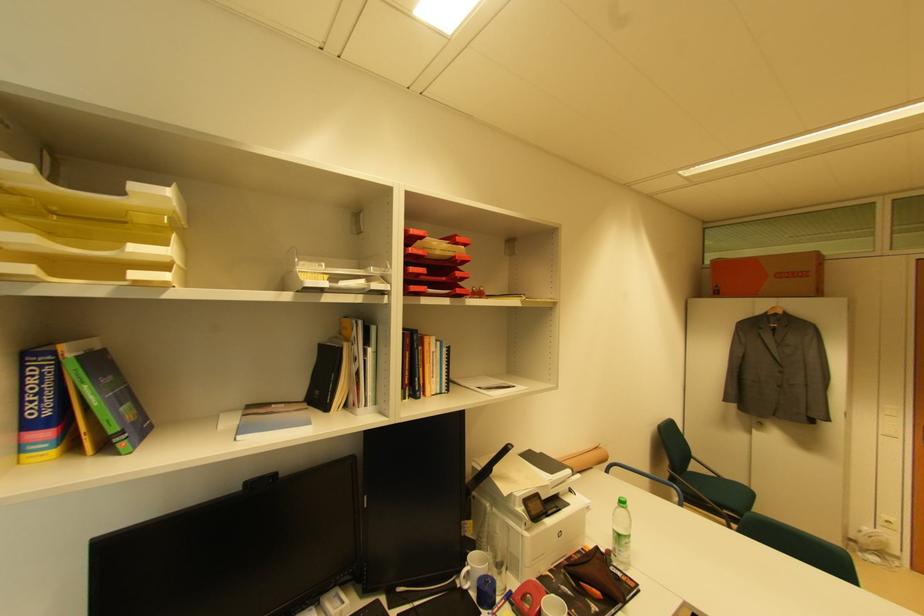
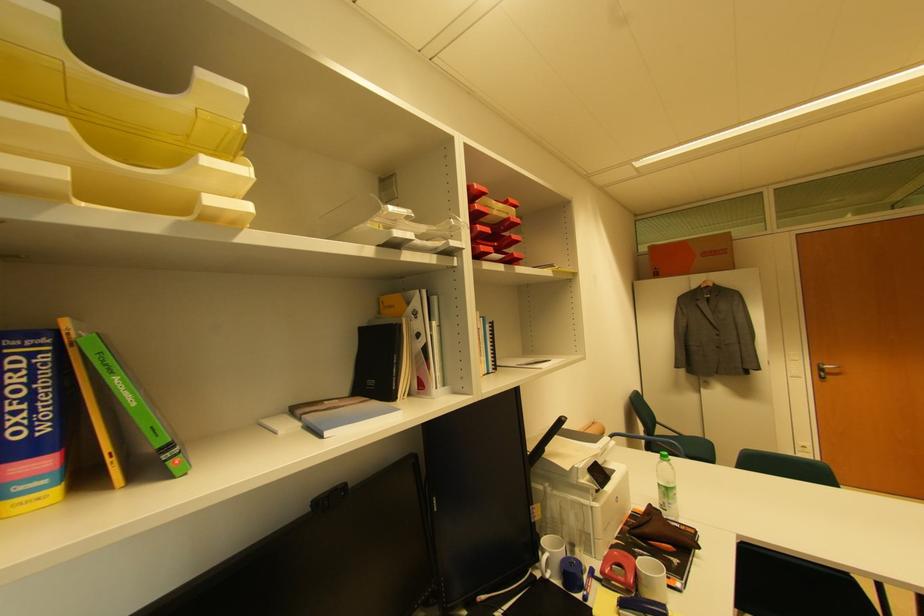
Question: Which direction would the cameraman need to move to produce the second image? Reply with the corresponding letter.

Choices:
 (A) Left
 (B) Right
 (C) Forward
 (D) Backward

Answer: (A)